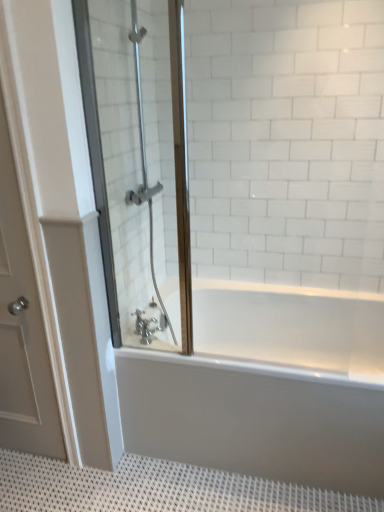
Question: From the image's perspective, is white matte door at left positioned above or below white textured bath mat at lower center?

Choices:
 (A) below
 (B) above

Answer: (B)

Question: Is white matte door at left taller or shorter than white textured bath mat at lower center?

Choices:
 (A) short
 (B) tall

Answer: (B)

Question: Estimate the real-world distances between objects in this image. Which object is closer to the chrome metallic faucet at lower center?

Choices:
 (A) clear glass shower door at left
 (B) white matte door at left
 (C) white glossy bathtub at center
 (D) white textured bath mat at lower center

Answer: (C)

Question: Which object is the farthest from the chrome metallic faucet at lower center?

Choices:
 (A) clear glass shower door at left
 (B) white matte door at left
 (C) white glossy bathtub at center
 (D) white textured bath mat at lower center

Answer: (D)